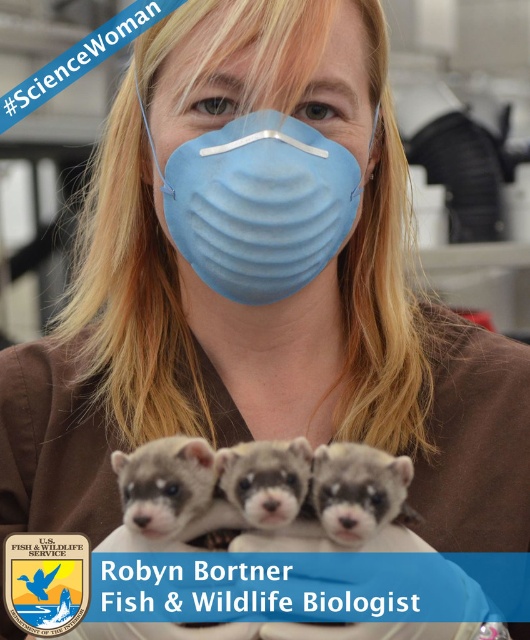
Question: Is blue non-woven fabric mask at center wider than fuzzy gray ferret at center?

Choices:
 (A) yes
 (B) no

Answer: (A)

Question: Estimate the real-world distances between objects in this image. Which object is farther from the fuzzy gray ferret at center?

Choices:
 (A) blue non-woven fabric mask at center
 (B) fuzzy white ferret at center

Answer: (A)

Question: Estimate the real-world distances between objects in this image. Which object is closer to the blue non-woven fabric mask at center?

Choices:
 (A) fuzzy gray ferret at center
 (B) fuzzy white ferret at center

Answer: (B)

Question: Does fuzzy gray ferret at center lie in front of fuzzy white ferret at center?

Choices:
 (A) yes
 (B) no

Answer: (A)

Question: Which object is the farthest from the fuzzy white ferret at center?

Choices:
 (A) blue non-woven fabric mask at center
 (B) fuzzy gray ferret at center

Answer: (A)

Question: Can you confirm if blue non-woven fabric mask at center is smaller than fuzzy white ferret at center?

Choices:
 (A) yes
 (B) no

Answer: (B)